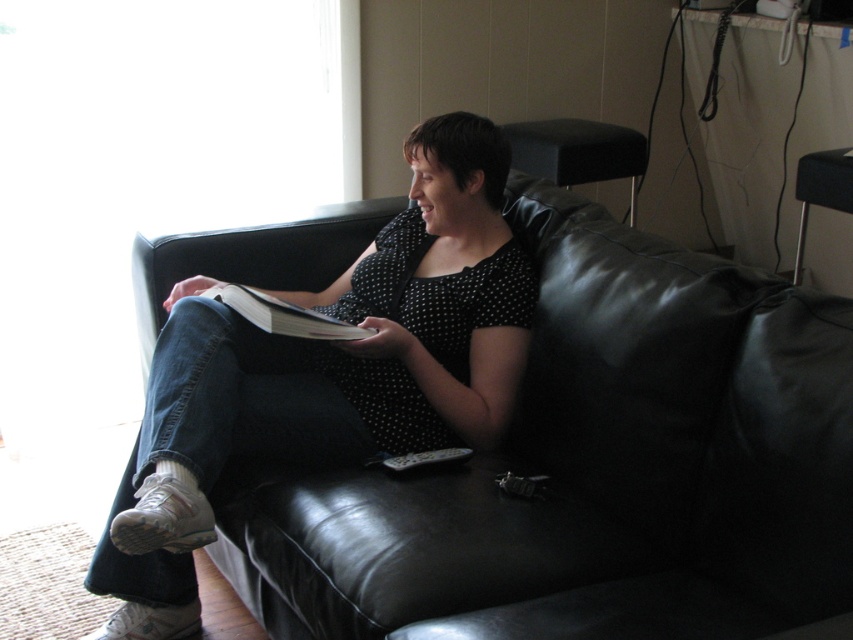
Question: Can you confirm if black leather couch at center is bigger than white paper magazine at center?

Choices:
 (A) yes
 (B) no

Answer: (A)

Question: Which point is closer to the camera taking this photo?

Choices:
 (A) (374, 540)
 (B) (332, 321)

Answer: (A)

Question: Which point appears farthest from the camera in this image?

Choices:
 (A) (381, 504)
 (B) (219, 300)

Answer: (B)

Question: Can you confirm if black leather couch at center is smaller than white paper magazine at center?

Choices:
 (A) yes
 (B) no

Answer: (B)

Question: Is black leather couch at center closer to the viewer compared to white paper magazine at center?

Choices:
 (A) no
 (B) yes

Answer: (B)

Question: Which object is closer to the camera taking this photo?

Choices:
 (A) black leather couch at center
 (B) white paper magazine at center

Answer: (A)